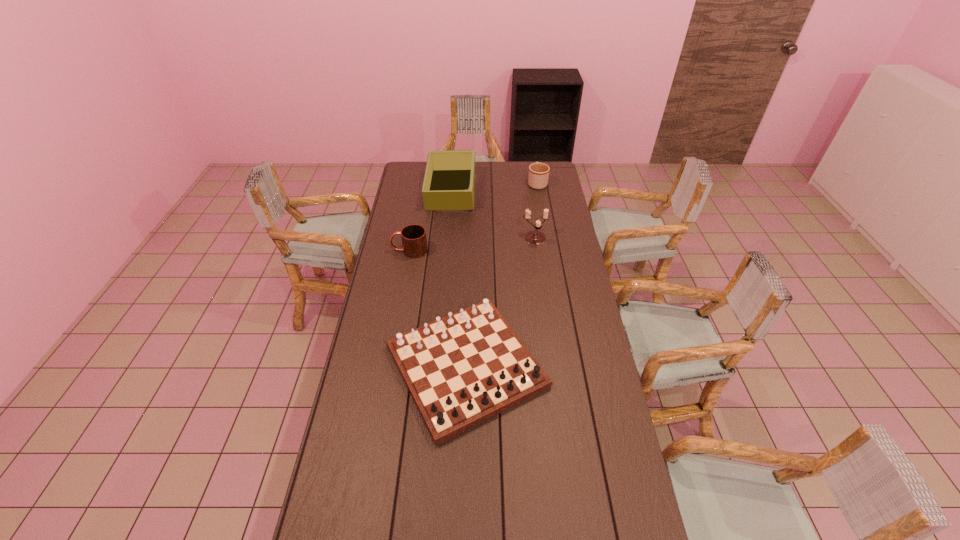
Where is `vacant area at the far left corner`? vacant area at the far left corner is located at coordinates (418, 174).

The width and height of the screenshot is (960, 540). Identify the location of unoccupied area between the box and the farther mug. (494, 187).

The width and height of the screenshot is (960, 540). I want to click on vacant point located between the box and the nearest object, so click(x=459, y=279).

Find the location of a particular element. free space that is in between the candle holder and the box is located at coordinates (493, 215).

Where is `vacant space that is in between the box and the candle holder`? vacant space that is in between the box and the candle holder is located at coordinates (493, 215).

The image size is (960, 540). Find the location of `the fourth closest object relative to the nearest object`. the fourth closest object relative to the nearest object is located at coordinates (538, 176).

Identify which object is located as the second nearest to the nearest object. Please provide its 2D coordinates. Your answer should be formatted as a tuple, i.e. [(x, y)], where the tuple contains the x and y coordinates of a point satisfying the conditions above.

[(535, 237)]